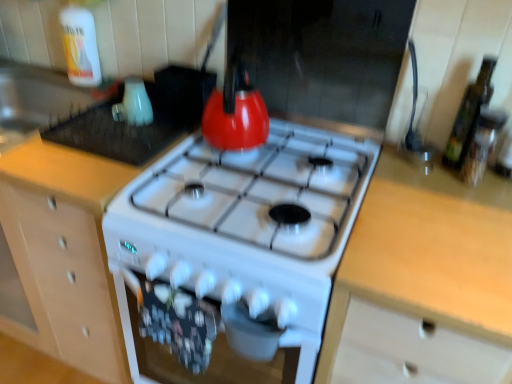
Question: Can you confirm if wooden cabinet at center is shorter than matte white kettle at upper left, the first appliance from the right?

Choices:
 (A) no
 (B) yes

Answer: (A)

Question: Can we say wooden cabinet at center lies outside matte white kettle at upper left, marked as the 2th appliance in a left-to-right arrangement?

Choices:
 (A) yes
 (B) no

Answer: (A)

Question: Is wooden cabinet at center at the right side of matte white kettle at upper left, the first appliance from the right?

Choices:
 (A) yes
 (B) no

Answer: (B)

Question: Is there a large distance between wooden cabinet at center and matte white kettle at upper left, marked as the 2th appliance in a left-to-right arrangement?

Choices:
 (A) no
 (B) yes

Answer: (A)

Question: Does wooden cabinet at center have a smaller size compared to matte white kettle at upper left, the first appliance from the right?

Choices:
 (A) yes
 (B) no

Answer: (B)

Question: Is point (345, 306) closer or farther from the camera than point (460, 107)?

Choices:
 (A) closer
 (B) farther

Answer: (A)

Question: From a real-world perspective, relative to green glass bottle at right, which is counted as the first bottle, starting from the front, is light wood countertop at right vertically above or below?

Choices:
 (A) below
 (B) above

Answer: (A)

Question: Looking at their shapes, would you say light wood countertop at right is wider or thinner than green glass bottle at right, the 2th bottle in the back-to-front sequence?

Choices:
 (A) thin
 (B) wide

Answer: (B)

Question: Is light wood countertop at right bigger or smaller than green glass bottle at right, which is counted as the first bottle, starting from the front?

Choices:
 (A) small
 (B) big

Answer: (B)

Question: Is translucent plastic bottle at upper left, which appears as the 1th bottle when viewed from the top, in front of or behind light wood countertop at right in the image?

Choices:
 (A) front
 (B) behind

Answer: (B)

Question: From their relative heights in the image, would you say translucent plastic bottle at upper left, which appears as the 1th bottle when viewed from the top, is taller or shorter than light wood countertop at right?

Choices:
 (A) tall
 (B) short

Answer: (B)

Question: From the image's perspective, is translucent plastic bottle at upper left, which is the first bottle in left-to-right order, located above or below light wood countertop at right?

Choices:
 (A) above
 (B) below

Answer: (A)

Question: Considering the relative positions of translucent plastic bottle at upper left, which ranks as the second bottle in front-to-back order, and light wood countertop at right in the image provided, is translucent plastic bottle at upper left, which ranks as the second bottle in front-to-back order, to the left or to the right of light wood countertop at right?

Choices:
 (A) left
 (B) right

Answer: (A)

Question: Considering the positions of green glass bottle at right, the second bottle viewed from the left, and light wood countertop at right in the image, is green glass bottle at right, the second bottle viewed from the left, wider or thinner than light wood countertop at right?

Choices:
 (A) thin
 (B) wide

Answer: (A)

Question: From their relative heights in the image, would you say green glass bottle at right, the 1th bottle viewed from the right, is taller or shorter than light wood countertop at right?

Choices:
 (A) tall
 (B) short

Answer: (B)